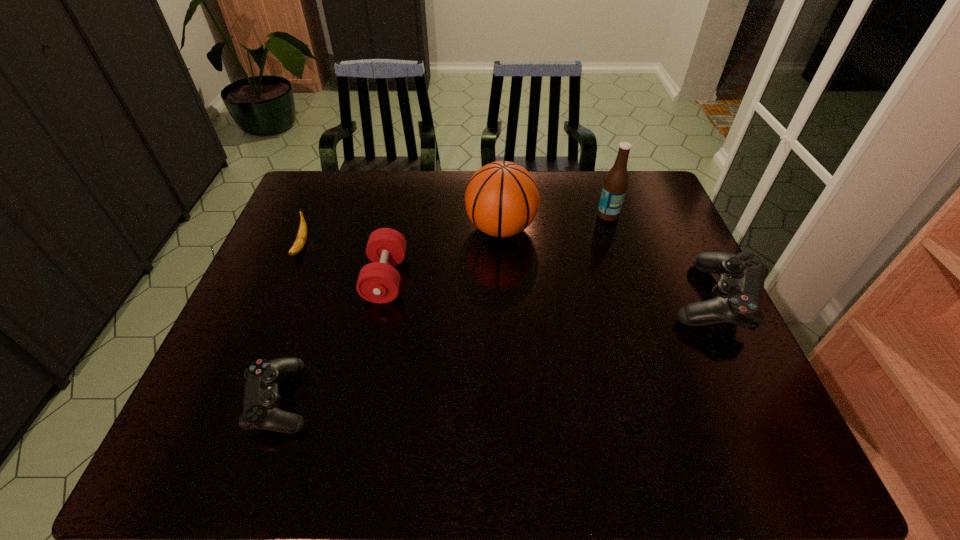
Please point a spot to place another control for symmetrical spacing. Please provide its 2D coordinates. Your answer should be formatted as a tuple, i.e. [(x, y)], where the tuple contains the x and y coordinates of a point satisfying the conditions above.

[(517, 344)]